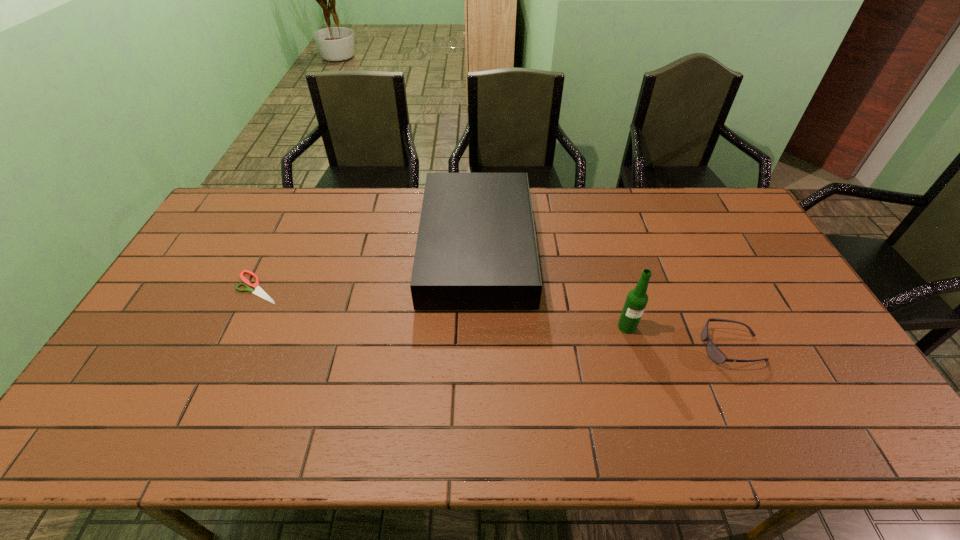
Where is `vacant space at the far right corner of the desktop`? vacant space at the far right corner of the desktop is located at coordinates coord(721,191).

Where is `blank region between the third tallest object and the tallest object`? This screenshot has height=540, width=960. blank region between the third tallest object and the tallest object is located at coordinates (680, 337).

The width and height of the screenshot is (960, 540). In order to click on free space between the third object from left to right and the second object from left to right in this screenshot , I will do `click(552, 287)`.

Find the location of a particular element. The image size is (960, 540). vacant area that lies between the rightmost object and the second object from right to left is located at coordinates (680, 337).

The width and height of the screenshot is (960, 540). Identify the location of free spot between the tallest object and the second shortest object. (680, 337).

This screenshot has width=960, height=540. Identify the location of blank region between the shortest object and the third shortest object. (368, 268).

At what (x,y) coordinates should I click in order to perform the action: click on vacant space that is in between the CD player and the leftmost object. Please return your answer as a coordinate pair (x, y). This screenshot has height=540, width=960. Looking at the image, I should click on (368, 268).

Where is `vacant point located between the second tallest object and the shortest object`? vacant point located between the second tallest object and the shortest object is located at coordinates (368, 268).

Locate an element on the screen. object that is the second closest to the scissors is located at coordinates (636, 301).

Find the location of a particular element. The width and height of the screenshot is (960, 540). object that ranks as the third closest to the third shortest object is located at coordinates (714, 353).